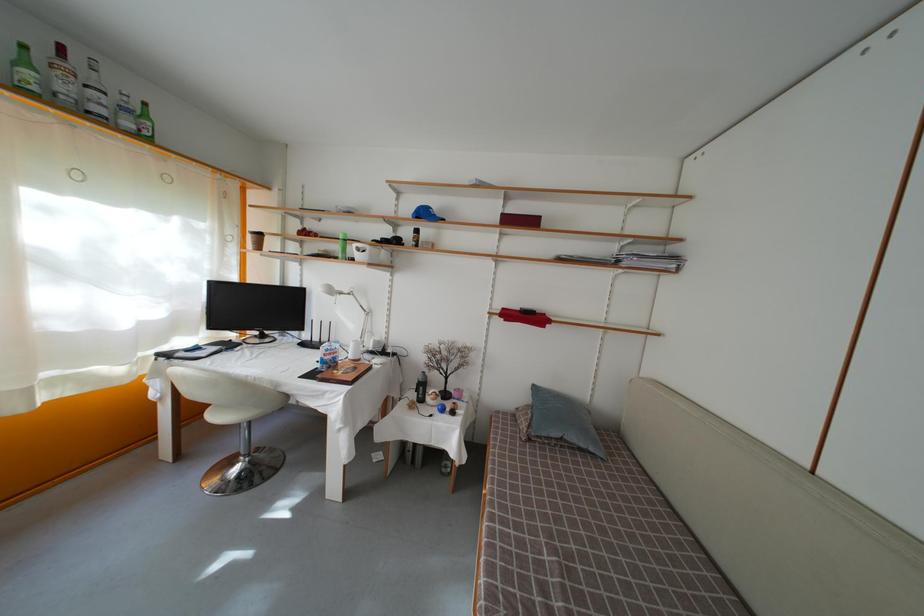
Describe the element at coordinates (365, 253) in the screenshot. I see `a white ceramic mug` at that location.